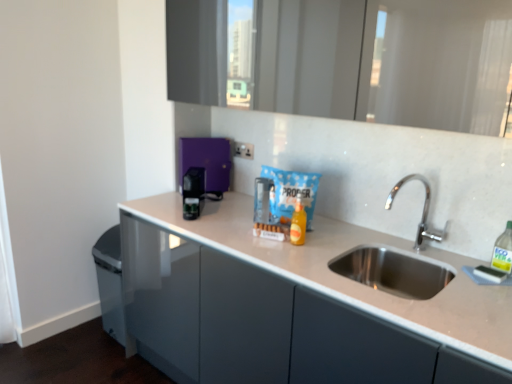
Question: Is green translucent bottle at right, which is the 2th bottle in left-to-right order, wider or thinner than purple glossy coffee machine at center, which appears as the first appliance when viewed from the back?

Choices:
 (A) thin
 (B) wide

Answer: (A)

Question: From their relative heights in the image, would you say green translucent bottle at right, which is the 2th bottle in left-to-right order, is taller or shorter than purple glossy coffee machine at center, which appears as the first appliance when viewed from the back?

Choices:
 (A) short
 (B) tall

Answer: (A)

Question: Which of these objects is positioned farthest from the white plastic electric outlet at center?

Choices:
 (A) green translucent bottle at right, which appears as the 1th bottle when viewed from the right
 (B) black plastic coffee machine at center, acting as the 2th appliance starting from the back
 (C) translucent orange bottle at center, the second bottle positioned from the front
 (D) purple glossy coffee machine at center, which appears as the first appliance when viewed from the back
 (E) white glossy countertop at center

Answer: (A)

Question: Based on their relative distances, which object is farther from the white glossy countertop at center?

Choices:
 (A) purple glossy coffee machine at center, which appears as the first appliance when viewed from the back
 (B) green translucent bottle at right, which is the first bottle from front to back
 (C) white plastic electric outlet at center
 (D) black plastic coffee machine at center, acting as the 2th appliance starting from the back
 (E) translucent orange bottle at center, which is the first bottle from back to front

Answer: (C)